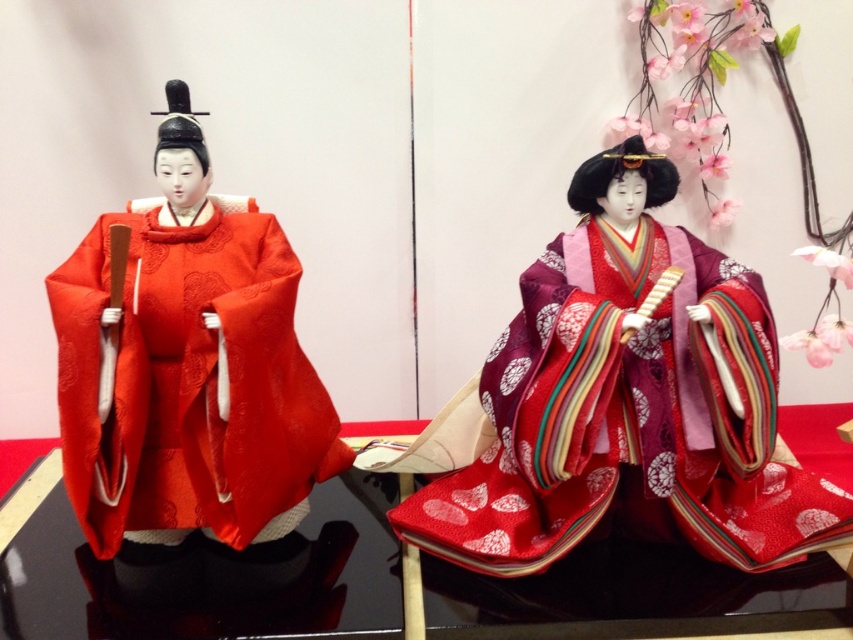
Question: Does silky red kimono at left appear on the left side of shiny black table at center?

Choices:
 (A) no
 (B) yes

Answer: (B)

Question: Among these objects, which one is nearest to the camera?

Choices:
 (A) shiny black table at center
 (B) silky red kimono at center
 (C) silky red kimono at left

Answer: (C)

Question: Which object appears closest to the camera in this image?

Choices:
 (A) silky red kimono at center
 (B) shiny black table at center
 (C) silky red kimono at left

Answer: (C)

Question: Can you confirm if silky red kimono at center is smaller than silky red kimono at left?

Choices:
 (A) no
 (B) yes

Answer: (A)

Question: Observing the image, what is the correct spatial positioning of silky red kimono at center in reference to silky red kimono at left?

Choices:
 (A) left
 (B) right

Answer: (B)

Question: Which object is the closest to the shiny black table at center?

Choices:
 (A) silky red kimono at left
 (B) silky red kimono at center

Answer: (B)